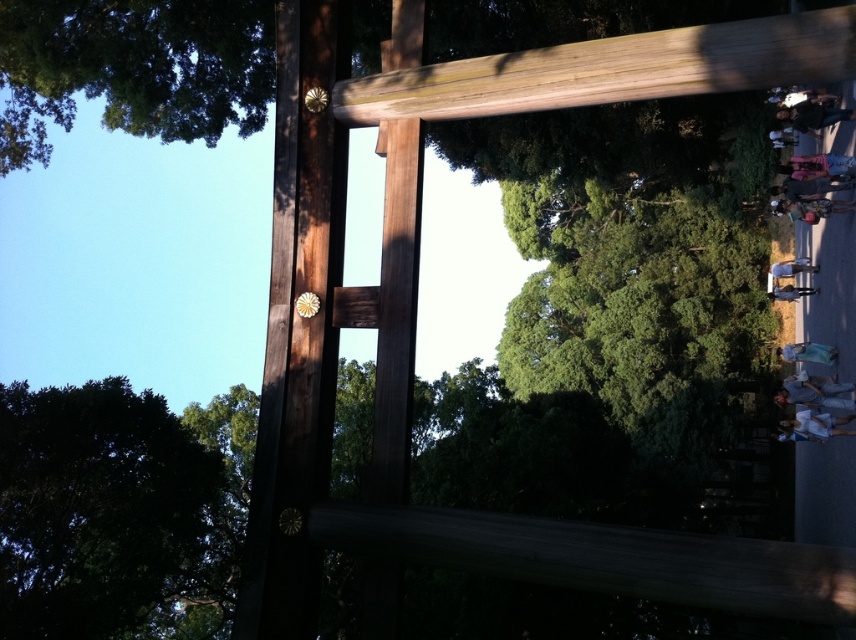
You are a photographer planning to take a photo of the dark green leafy tree at lower left and the light brown wood beam at upper center. Which object will appear bigger in your photo?

The dark green leafy tree at lower left will appear bigger in the photo because it has a larger size compared to the light brown wood beam at upper center.

You are standing in front of the torii gate and want to take a photo that includes both the torii gate and the green leafy tree at upper left. Based on their positions, where should you position yourself to ensure both are in the frame?

Since the green leafy tree at upper left is located at point (134, 68), you should position yourself to the left side of the torii gate to include both the torii gate and the green leafy tree at upper left in the frame.